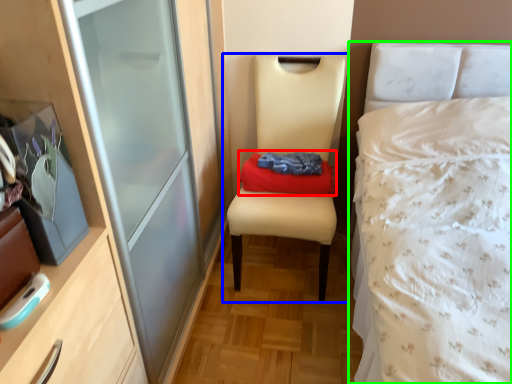
Question: Based on their relative distances, which object is nearer to clothing (highlighted by a red box)? Choose from chair (highlighted by a blue box) and bed (highlighted by a green box).

Choices:
 (A) chair
 (B) bed

Answer: (A)